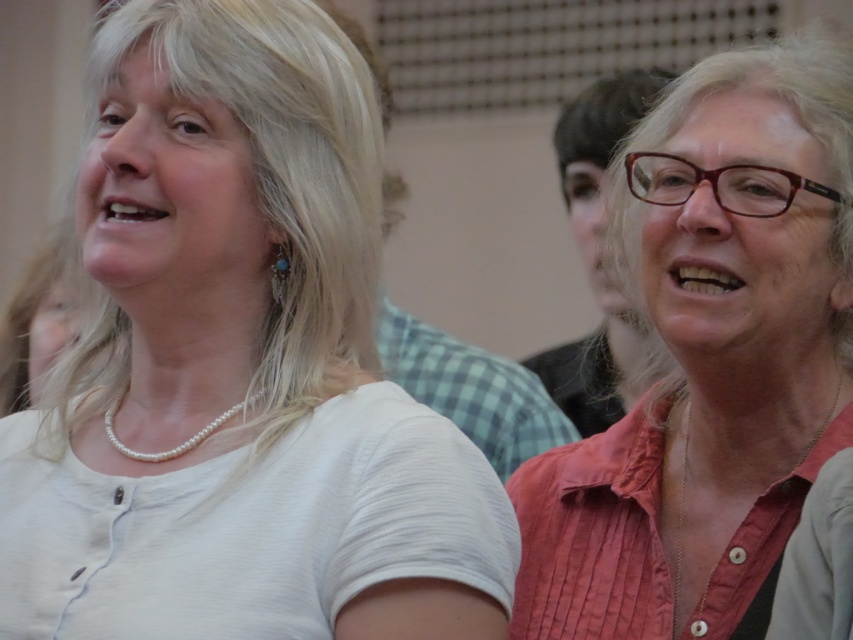
Does white matte shirt at center have a greater height compared to checkered fabric shirt at center?

Incorrect, white matte shirt at center's height is not larger of checkered fabric shirt at center's.

Can you confirm if white matte shirt at center is wider than checkered fabric shirt at center?

Yes.

Based on the photo, who is more distant from viewer, (350, 205) or (375, 54)?

The point (375, 54) is behind.

Locate an element on the screen. The height and width of the screenshot is (640, 853). white matte shirt at center is located at coordinates (239, 368).

Can you confirm if pink fabric shirt at center is wider than pearl necklace at center?

Correct, the width of pink fabric shirt at center exceeds that of pearl necklace at center.

Based on the photo, does pink fabric shirt at center have a lesser height compared to pearl necklace at center?

In fact, pink fabric shirt at center may be taller than pearl necklace at center.

You are a GUI agent. You are given a task and a screenshot of the screen. Output one action in this format:
    pyautogui.click(x=<x>, y=<y>)
    Task: Click on the pink fabric shirt at center
    The image size is (853, 640).
    Given the screenshot: What is the action you would take?
    pyautogui.click(x=709, y=356)

Is pink fabric shirt at center to the right of checkered fabric shirt at center from the viewer's perspective?

Yes, pink fabric shirt at center is to the right of checkered fabric shirt at center.

Does pink fabric shirt at center have a lesser height compared to checkered fabric shirt at center?

Indeed, pink fabric shirt at center has a lesser height compared to checkered fabric shirt at center.

Does point (689, 605) lie behind point (370, 67)?

No.

Where is `pink fabric shirt at center`? The width and height of the screenshot is (853, 640). pink fabric shirt at center is located at coordinates (709, 356).